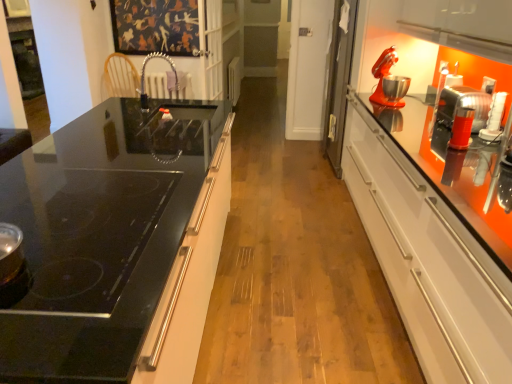
Find the location of a particular element. black glass cooktop at left is located at coordinates (116, 244).

This screenshot has width=512, height=384. Describe the element at coordinates (116, 244) in the screenshot. I see `black glass cooktop at left` at that location.

The width and height of the screenshot is (512, 384). In order to click on satin nickel faucet at center in this screenshot , I will do `click(144, 77)`.

What do you see at coordinates (144, 77) in the screenshot?
I see `satin nickel faucet at center` at bounding box center [144, 77].

What do you see at coordinates (234, 80) in the screenshot?
I see `white plastic radiator at center, acting as the first appliance starting from the top` at bounding box center [234, 80].

Identify the location of orange metallic mixer at right, which is the 2th appliance in back-to-front order. The width and height of the screenshot is (512, 384). (463, 106).

The height and width of the screenshot is (384, 512). Find the location of `matte red mixer at upper right`. matte red mixer at upper right is located at coordinates (389, 81).

Is black glass cooktop at left aimed at satin nickel faucet at center?

No, black glass cooktop at left is not turned towards satin nickel faucet at center.

Does black glass cooktop at left have a greater width compared to satin nickel faucet at center?

Yes, black glass cooktop at left is wider than satin nickel faucet at center.

Is black glass cooktop at left in front of or behind satin nickel faucet at center in the image?

black glass cooktop at left is in front of satin nickel faucet at center.

How many degrees apart are the facing directions of black glass cooktop at left and satin nickel faucet at center?

The angular difference between black glass cooktop at left and satin nickel faucet at center is 0.945 degrees.

Consider the image. From a real-world perspective, between matte red mixer at upper right and satin nickel faucet at center, who is vertically lower?

In real-world perspective, satin nickel faucet at center is lower.

Between matte red mixer at upper right and satin nickel faucet at center, which one has smaller width?

matte red mixer at upper right is thinner.

Considering the points (385, 100) and (142, 83), which point is behind, point (385, 100) or point (142, 83)?

The point (142, 83) is more distant.

Is black glass cooktop at left looking in the opposite direction of orange metallic mixer at right, the 2th appliance from the left?

No.

From a real-world perspective, between black glass cooktop at left and orange metallic mixer at right, which is the 2th appliance in back-to-front order, who is vertically lower?

From a 3D spatial view, black glass cooktop at left is below.

What's the angular difference between black glass cooktop at left and orange metallic mixer at right, the first appliance when ordered from front to back,'s facing directions?

There is a 178-degree angle between the facing directions of black glass cooktop at left and orange metallic mixer at right, the first appliance when ordered from front to back.

Would you say white plastic radiator at center, acting as the first appliance starting from the top, contains satin nickel faucet at center?

Actually, satin nickel faucet at center is outside white plastic radiator at center, acting as the first appliance starting from the top.

Considering the relative sizes of white plastic radiator at center, positioned as the second appliance in front-to-back order, and satin nickel faucet at center in the image provided, is white plastic radiator at center, positioned as the second appliance in front-to-back order, thinner than satin nickel faucet at center?

Yes, white plastic radiator at center, positioned as the second appliance in front-to-back order, is thinner than satin nickel faucet at center.

From the image's perspective, which one is positioned higher, white plastic radiator at center, the second appliance when ordered from bottom to top, or satin nickel faucet at center?

white plastic radiator at center, the second appliance when ordered from bottom to top, is shown above in the image.

Is white plastic radiator at center, the first appliance when ordered from left to right, touching satin nickel faucet at center?

No, white plastic radiator at center, the first appliance when ordered from left to right, is not touching satin nickel faucet at center.

From the image's perspective, is white plastic radiator at center, acting as the first appliance starting from the top, on black glass cooktop at left?

Yes, from the image's perspective, white plastic radiator at center, acting as the first appliance starting from the top, is above black glass cooktop at left.

Does white plastic radiator at center, acting as the first appliance starting from the top, have a greater height compared to black glass cooktop at left?

No.

Considering the points (237, 58) and (196, 127), which point is in front, point (237, 58) or point (196, 127)?

The point (196, 127) is more forward.

You are a GUI agent. You are given a task and a screenshot of the screen. Output one action in this format:
    pyautogui.click(x=<x>, y=<y>)
    Task: Click on the countertop on the left of matte red mixer at upper right
    This screenshot has height=384, width=512.
    Given the screenshot: What is the action you would take?
    pyautogui.click(x=116, y=244)

Is matte red mixer at upper right at the right side of black glass cooktop at left?

Yes.

Is matte red mixer at upper right looking in the opposite direction of black glass cooktop at left?

No, black glass cooktop at left is not at the back of matte red mixer at upper right.

Based on the photo, who is smaller, matte red mixer at upper right or black glass cooktop at left?

matte red mixer at upper right.

Is orange metallic mixer at right, arranged as the 2th appliance when viewed from the top, taller than matte red mixer at upper right?

Incorrect, the height of orange metallic mixer at right, arranged as the 2th appliance when viewed from the top, is not larger of that of matte red mixer at upper right.

Can we say orange metallic mixer at right, the first appliance when ordered from front to back, lies outside matte red mixer at upper right?

Yes, orange metallic mixer at right, the first appliance when ordered from front to back, is outside of matte red mixer at upper right.

Would you consider orange metallic mixer at right, arranged as the 2th appliance when viewed from the top, to be distant from matte red mixer at upper right?

Actually, orange metallic mixer at right, arranged as the 2th appliance when viewed from the top, and matte red mixer at upper right are a little close together.

How different are the orientations of orange metallic mixer at right, the 1th appliance in the bottom-to-top sequence, and matte red mixer at upper right in degrees?

13.3 degrees separate the facing orientations of orange metallic mixer at right, the 1th appliance in the bottom-to-top sequence, and matte red mixer at upper right.

Identify the location of faucet on the right of black glass cooktop at left. (144, 77).

Locate an element on the screen. faucet below the matte red mixer at upper right (from a real-world perspective) is located at coordinates (144, 77).

Looking at the image, which one is located further to black glass cooktop at left, satin nickel faucet at center or white plastic radiator at center, acting as the first appliance starting from the top?

white plastic radiator at center, acting as the first appliance starting from the top, is positioned further to the anchor black glass cooktop at left.

When comparing their distances from white plastic radiator at center, the second appliance when ordered from bottom to top, does black glass cooktop at left or matte red mixer at upper right seem further?

black glass cooktop at left lies further to white plastic radiator at center, the second appliance when ordered from bottom to top, than the other object.

Estimate the real-world distances between objects in this image. Which object is closer to matte red mixer at upper right, orange metallic mixer at right, the 1th appliance in the bottom-to-top sequence, or satin nickel faucet at center?

orange metallic mixer at right, the 1th appliance in the bottom-to-top sequence, is closer to matte red mixer at upper right.

Considering their positions, is satin nickel faucet at center positioned further to black glass cooktop at left than matte red mixer at upper right?

satin nickel faucet at center lies further to black glass cooktop at left than the other object.

Estimate the real-world distances between objects in this image. Which object is further from matte red mixer at upper right, white plastic radiator at center, positioned as the second appliance in front-to-back order, or orange metallic mixer at right, the first appliance when ordered from front to back?

white plastic radiator at center, positioned as the second appliance in front-to-back order, is positioned further to the anchor matte red mixer at upper right.

From the image, which object appears to be nearer to black glass cooktop at left, matte red mixer at upper right or satin nickel faucet at center?

matte red mixer at upper right is positioned closer to the anchor black glass cooktop at left.

Consider the image. Considering their positions, is satin nickel faucet at center positioned further to orange metallic mixer at right, the first appliance when ordered from front to back, than matte red mixer at upper right?

satin nickel faucet at center is positioned further to the anchor orange metallic mixer at right, the first appliance when ordered from front to back.

Which object lies nearer to the anchor point matte red mixer at upper right, satin nickel faucet at center or orange metallic mixer at right, the first appliance when ordered from front to back?

orange metallic mixer at right, the first appliance when ordered from front to back, lies closer to matte red mixer at upper right than the other object.

Where is `home appliance situated between black glass cooktop at left and orange metallic mixer at right, the 1th appliance in the bottom-to-top sequence, from left to right`? This screenshot has height=384, width=512. home appliance situated between black glass cooktop at left and orange metallic mixer at right, the 1th appliance in the bottom-to-top sequence, from left to right is located at coordinates (389, 81).

Where is `appliance between black glass cooktop at left and white plastic radiator at center, the first appliance when ordered from left to right, from front to back`? Image resolution: width=512 pixels, height=384 pixels. appliance between black glass cooktop at left and white plastic radiator at center, the first appliance when ordered from left to right, from front to back is located at coordinates (463, 106).

The image size is (512, 384). Identify the location of home appliance between satin nickel faucet at center and white plastic radiator at center, acting as the first appliance starting from the top, along the z-axis. (389, 81).

The image size is (512, 384). I want to click on faucet positioned between black glass cooktop at left and matte red mixer at upper right from near to far, so click(x=144, y=77).